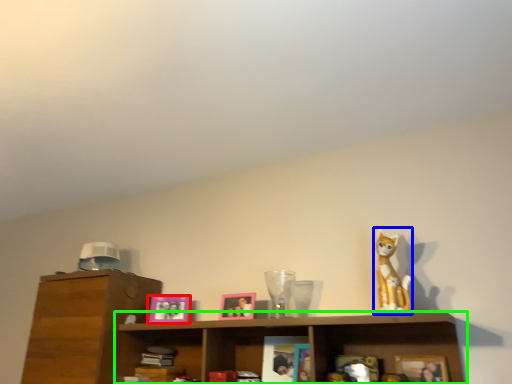
Question: Which is farther away from picture frame (highlighted by a red box)? toy (highlighted by a blue box) or shelf (highlighted by a green box)?

Choices:
 (A) toy
 (B) shelf

Answer: (A)